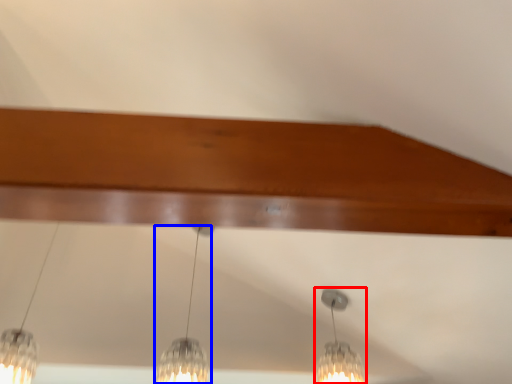
Question: Among these objects, which one is farthest to the camera, lamp (highlighted by a red box) or lamp (highlighted by a blue box)?

Choices:
 (A) lamp
 (B) lamp

Answer: (A)